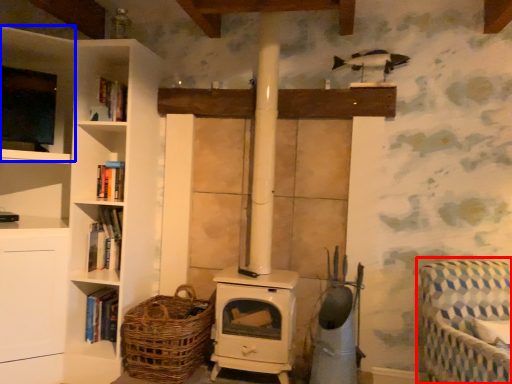
Question: Which object appears farthest to the camera in this image, rocking chair (highlighted by a red box) or shelf (highlighted by a blue box)?

Choices:
 (A) rocking chair
 (B) shelf

Answer: (B)